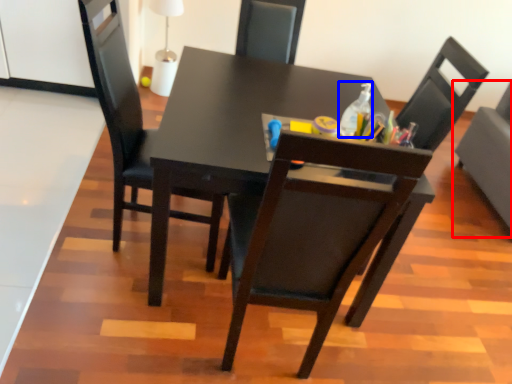
Question: Among these objects, which one is farthest to the camera, chair (highlighted by a red box) or bottle (highlighted by a blue box)?

Choices:
 (A) chair
 (B) bottle

Answer: (A)